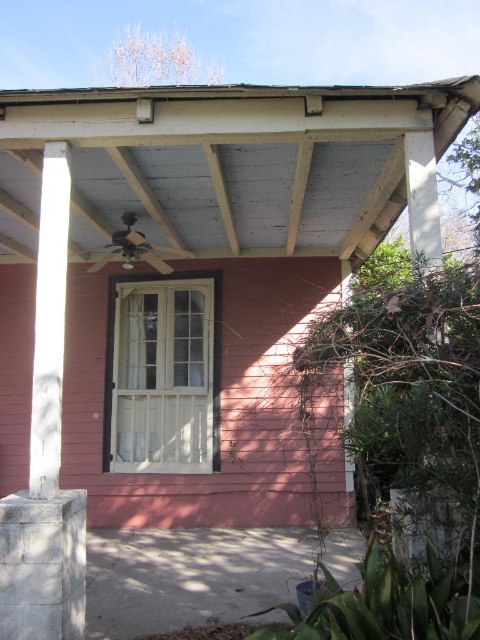
Question: Among these objects, which one is farthest from the camera?

Choices:
 (A) wooden ceiling at center
 (B) white painted wood beam at left

Answer: (A)

Question: Among these objects, which one is farthest from the camera?

Choices:
 (A) wooden ceiling at center
 (B) white painted wood beam at left

Answer: (A)

Question: Is wooden ceiling at center above white painted wood beam at left?

Choices:
 (A) no
 (B) yes

Answer: (B)

Question: Does wooden ceiling at center have a lesser width compared to white painted wood beam at left?

Choices:
 (A) yes
 (B) no

Answer: (B)

Question: Is wooden ceiling at center wider than white painted wood beam at left?

Choices:
 (A) yes
 (B) no

Answer: (A)